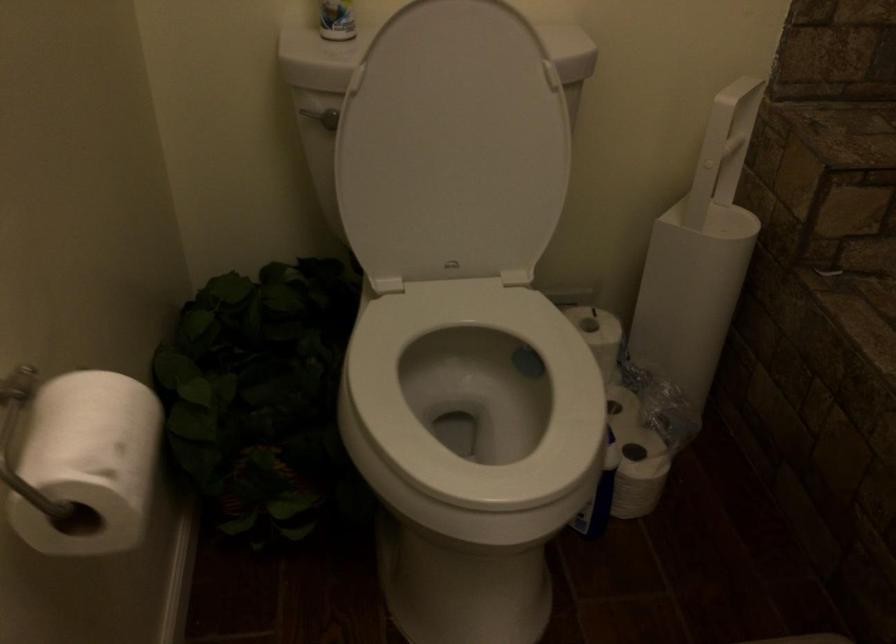
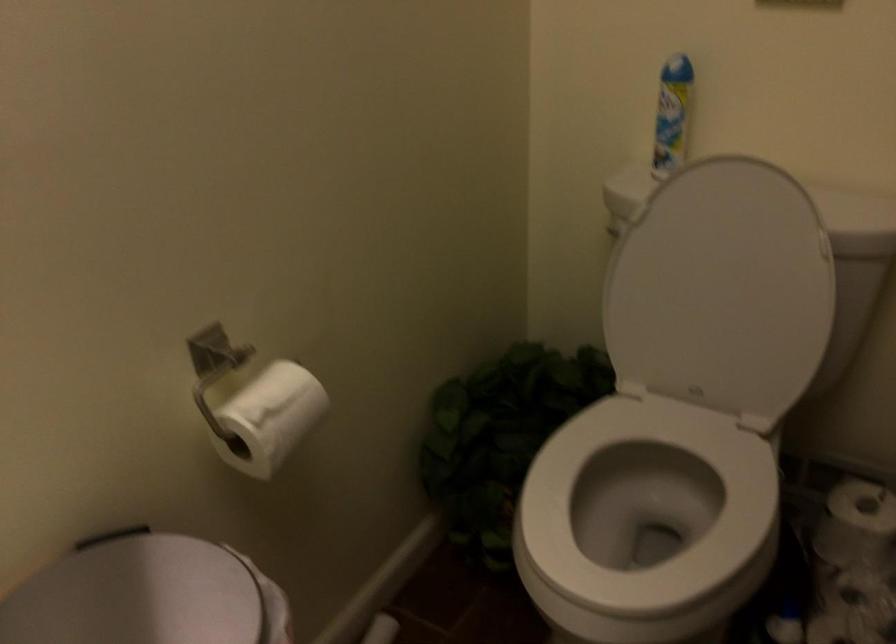
The point at (595, 339) is marked in the first image. Where is the corresponding point in the second image?

(856, 523)